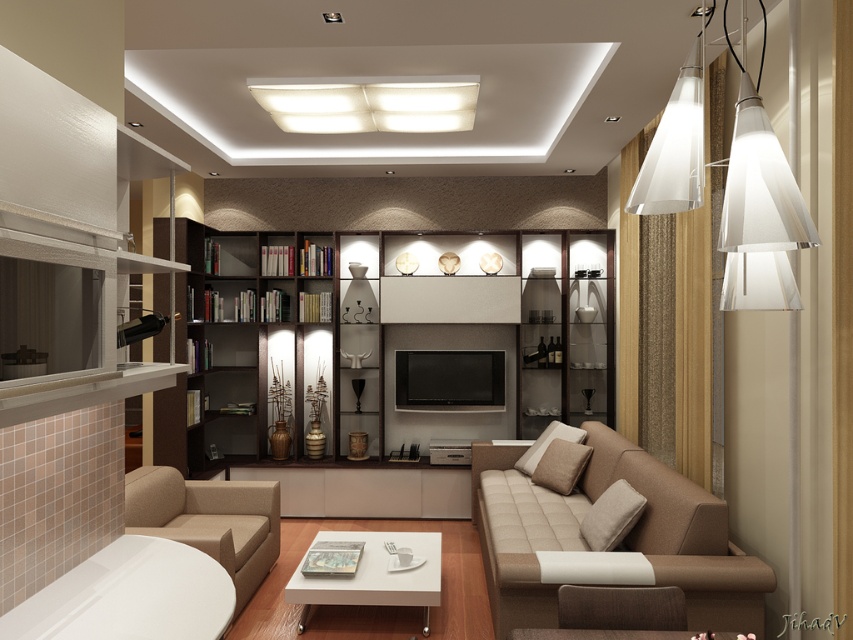
Between beige fabric couch at lower right and white glossy coffee table at center, which one appears on the left side from the viewer's perspective?

white glossy coffee table at center is more to the left.

The width and height of the screenshot is (853, 640). I want to click on beige fabric couch at lower right, so tap(618, 547).

The height and width of the screenshot is (640, 853). In order to click on beige fabric couch at lower right in this screenshot , I will do (618, 547).

Is beige fabric couch at lower right closer to the viewer compared to beige fabric armchair at lower left?

That is True.

Where is `beige fabric couch at lower right`? This screenshot has width=853, height=640. beige fabric couch at lower right is located at coordinates (618, 547).

Which is behind, point (779, 227) or point (180, 477)?

Positioned behind is point (180, 477).

Is point (741, 234) closer to viewer compared to point (235, 561)?

Yes, it is in front of point (235, 561).

You are a GUI agent. You are given a task and a screenshot of the screen. Output one action in this format:
    pyautogui.click(x=<x>, y=<y>)
    Task: Click on the white translucent pendant lights at upper right
    This screenshot has height=640, width=853.
    Given the screenshot: What is the action you would take?
    pyautogui.click(x=759, y=204)